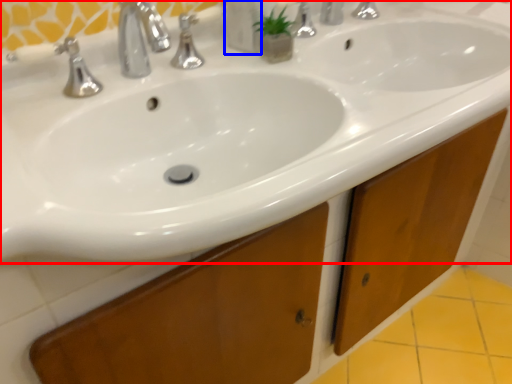
Question: Which of the following is the closest to the observer, sink (highlighted by a red box) or soap dispenser (highlighted by a blue box)?

Choices:
 (A) sink
 (B) soap dispenser

Answer: (A)